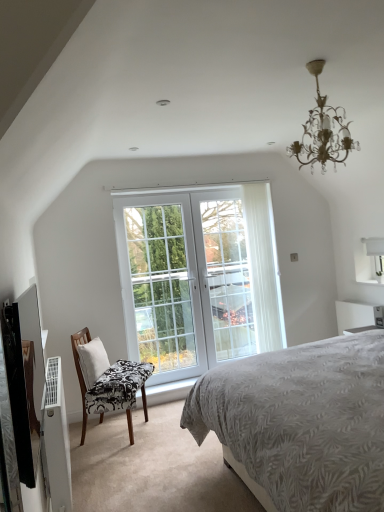
Question: From a real-world perspective, is white glass door at center, marked as the second window in a right-to-left arrangement, beneath white glass door at center, which is the first window in right-to-left order?

Choices:
 (A) yes
 (B) no

Answer: (A)

Question: Can you confirm if white glass door at center, placed as the first window when sorted from left to right, is thinner than white glass door at center, which appears as the 2th window when viewed from the left?

Choices:
 (A) yes
 (B) no

Answer: (A)

Question: Is white glass door at center, placed as the first window when sorted from left to right, touching white glass door at center, which appears as the 2th window when viewed from the left?

Choices:
 (A) yes
 (B) no

Answer: (B)

Question: Is white glass door at center, marked as the second window in a right-to-left arrangement, aimed at white glass door at center, which is the first window in right-to-left order?

Choices:
 (A) yes
 (B) no

Answer: (A)

Question: Does white glass door at center, placed as the first window when sorted from left to right, come behind white glass door at center, which appears as the 2th window when viewed from the left?

Choices:
 (A) yes
 (B) no

Answer: (A)

Question: From the image's perspective, is white fabric pillow at left positioned above or below black and white patterned fabric chair at lower left?

Choices:
 (A) below
 (B) above

Answer: (B)

Question: From their relative heights in the image, would you say white fabric pillow at left is taller or shorter than black and white patterned fabric chair at lower left?

Choices:
 (A) short
 (B) tall

Answer: (A)

Question: Is white fabric pillow at left situated inside black and white patterned fabric chair at lower left or outside?

Choices:
 (A) outside
 (B) inside

Answer: (B)

Question: Considering the positions of point (92, 346) and point (114, 376), is point (92, 346) closer or farther from the camera than point (114, 376)?

Choices:
 (A) farther
 (B) closer

Answer: (A)

Question: Is point (82, 415) positioned closer to the camera than point (134, 218)?

Choices:
 (A) farther
 (B) closer

Answer: (B)

Question: In terms of size, does black and white patterned fabric chair at lower left appear bigger or smaller than white glass door at center, which appears as the 2th window when viewed from the left?

Choices:
 (A) big
 (B) small

Answer: (B)

Question: Which is correct: black and white patterned fabric chair at lower left is inside white glass door at center, which appears as the 2th window when viewed from the left, or outside of it?

Choices:
 (A) outside
 (B) inside

Answer: (A)

Question: Considering the positions of black and white patterned fabric chair at lower left and white glass door at center, which is the first window in right-to-left order, in the image, is black and white patterned fabric chair at lower left wider or thinner than white glass door at center, which is the first window in right-to-left order,?

Choices:
 (A) thin
 (B) wide

Answer: (B)

Question: Based on their positions, is white fabric pillow at left located to the left or right of white glass door at center, marked as the second window in a right-to-left arrangement?

Choices:
 (A) left
 (B) right

Answer: (A)

Question: Is white fabric pillow at left situated inside white glass door at center, placed as the first window when sorted from left to right, or outside?

Choices:
 (A) inside
 (B) outside

Answer: (B)